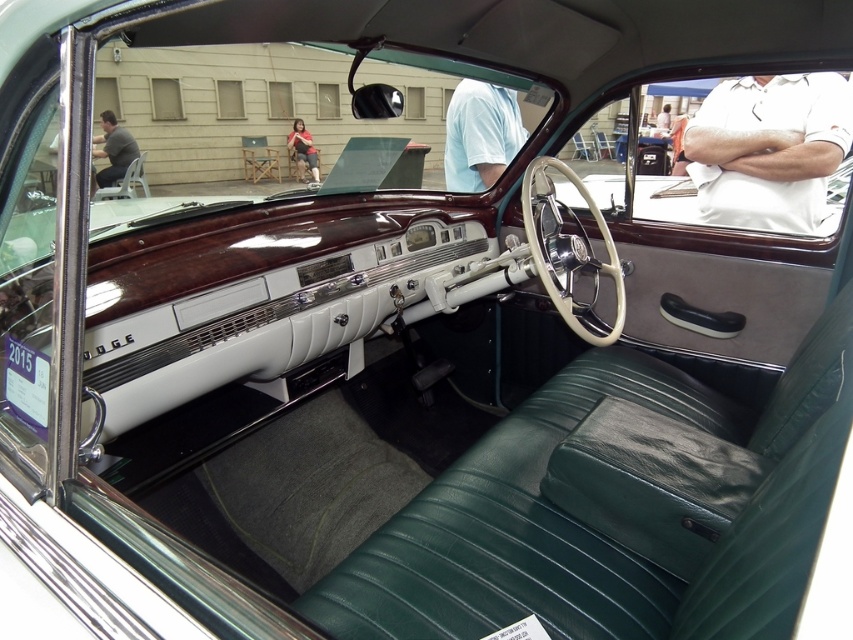
You are sitting in the driver seat of the vintage car and notice a point marked at coordinates [769,148]. Based on the car interior described, what object is located at that point?

The point at coordinates [769,148] corresponds to the white cotton shirt at upper right.

You are a tailor who needs to determine if two shirts can fit side by side on a 1.2 meter wide table. The shirts are the white cotton shirt at upper right and the light blue fabric shirt at upper center. Based on their widths, will both shirts fit on the table without overlapping?

The white cotton shirt at upper right might be wider than the light blue fabric shirt at upper center. If the white cotton shirt at upper right is wider, then the combined width of both shirts could exceed 1.2 meters, making it uncertain if they will fit without overlapping. Further measurement is needed to confirm.

You are a tailor observing the vintage car interior and notice two shirts hanging on the back of the seats. The shirts are the white cotton shirt at upper right and the light blue fabric shirt at upper center. Which shirt is taller?

The white cotton shirt at upper right is taller than the light blue fabric shirt at upper center.